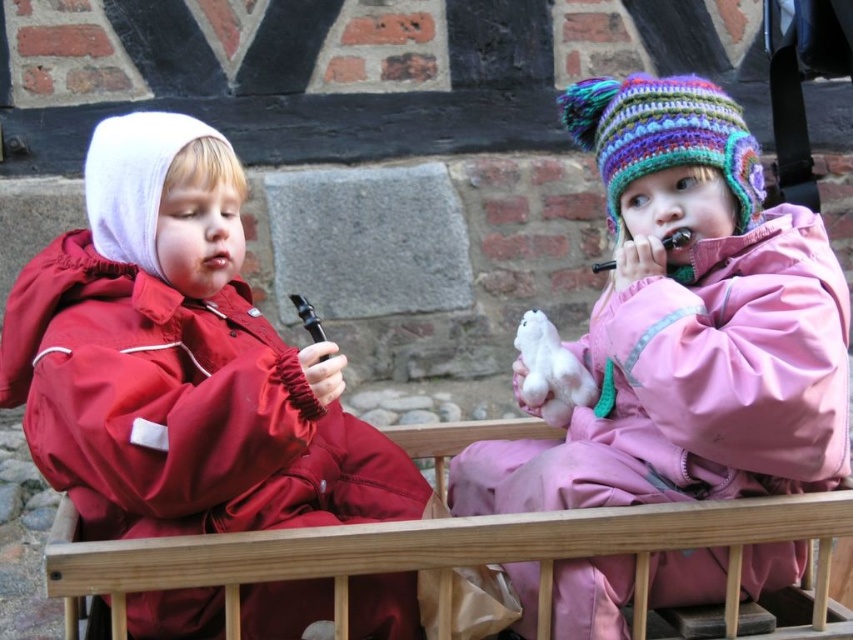
Question: Considering the relative positions of pink matte snowsuit at center and white plush toy at center in the image provided, where is pink matte snowsuit at center located with respect to white plush toy at center?

Choices:
 (A) below
 (B) above

Answer: (B)

Question: From the image, what is the correct spatial relationship of wooden bench at center in relation to white plush toy at center?

Choices:
 (A) below
 (B) above

Answer: (A)

Question: Which object is farther from the camera taking this photo?

Choices:
 (A) wooden bench at center
 (B) matte pink lips at center
 (C) pink matte snowsuit at center
 (D) matte red jacket at left

Answer: (B)

Question: Considering the real-world distances, which object is farthest from the wooden bench at center?

Choices:
 (A) white plush toy at center
 (B) pink matte snowsuit at center

Answer: (A)

Question: Does wooden bench at center have a greater width compared to matte pink lips at center?

Choices:
 (A) no
 (B) yes

Answer: (B)

Question: Among these points, which one is farthest from the camera?

Choices:
 (A) (196, 573)
 (B) (173, 180)
 (C) (709, 298)
 (D) (231, 253)

Answer: (D)